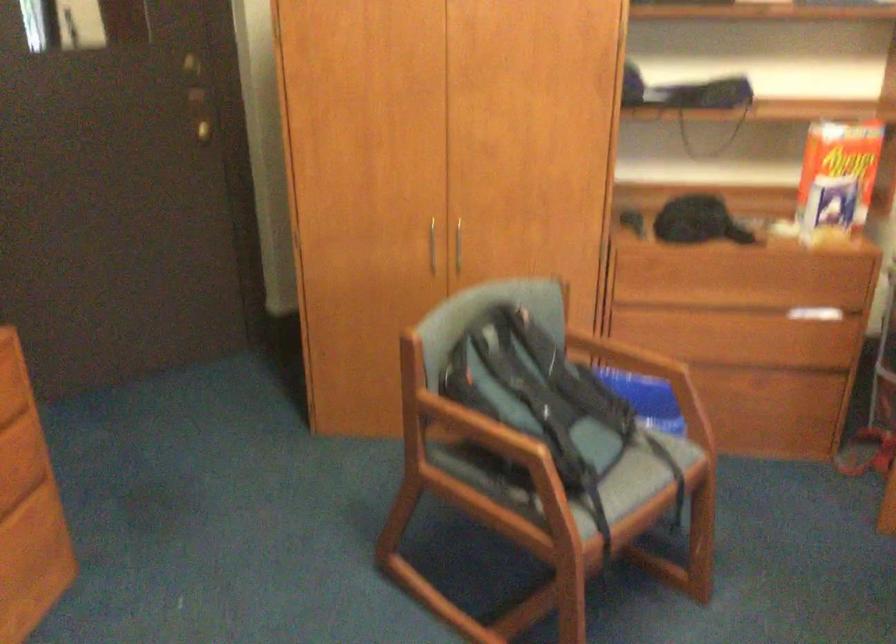
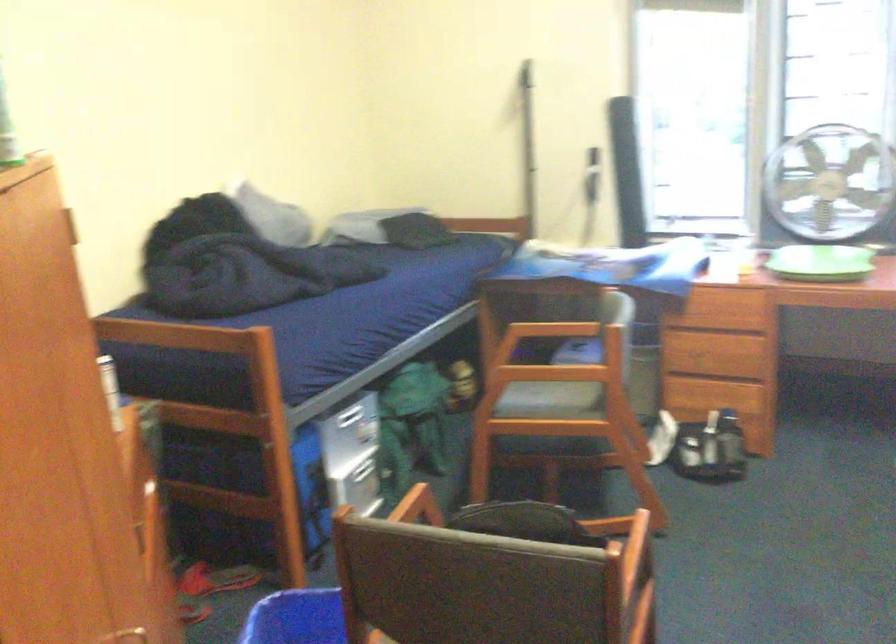
Where in the second image is the point corresponding to point (481, 354) from the first image?

(528, 523)